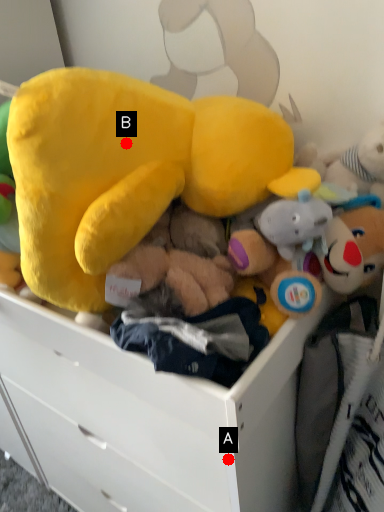
Question: Two points are circled on the image, labeled by A and B beside each circle. Which point is closer to the camera taking this photo?

Choices:
 (A) A is closer
 (B) B is closer

Answer: (B)